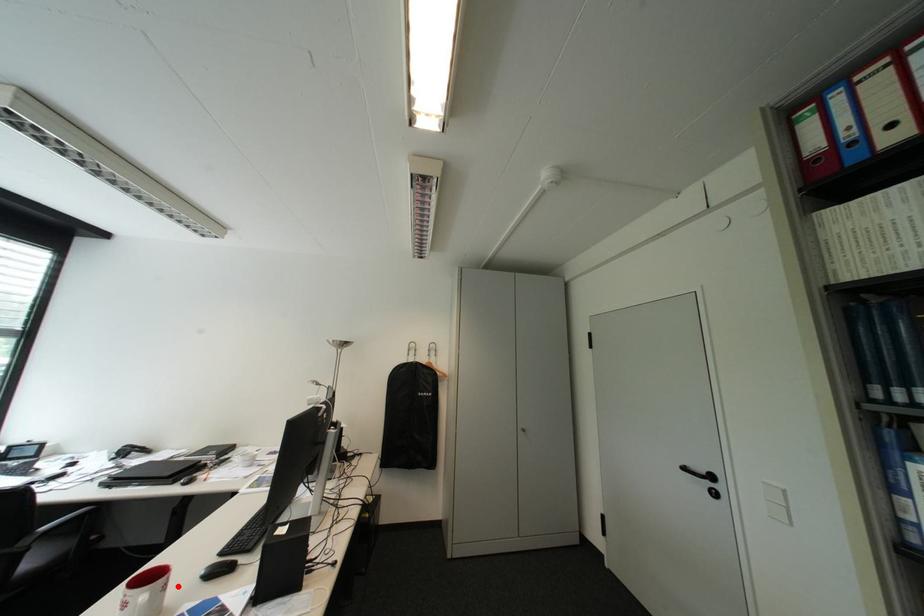
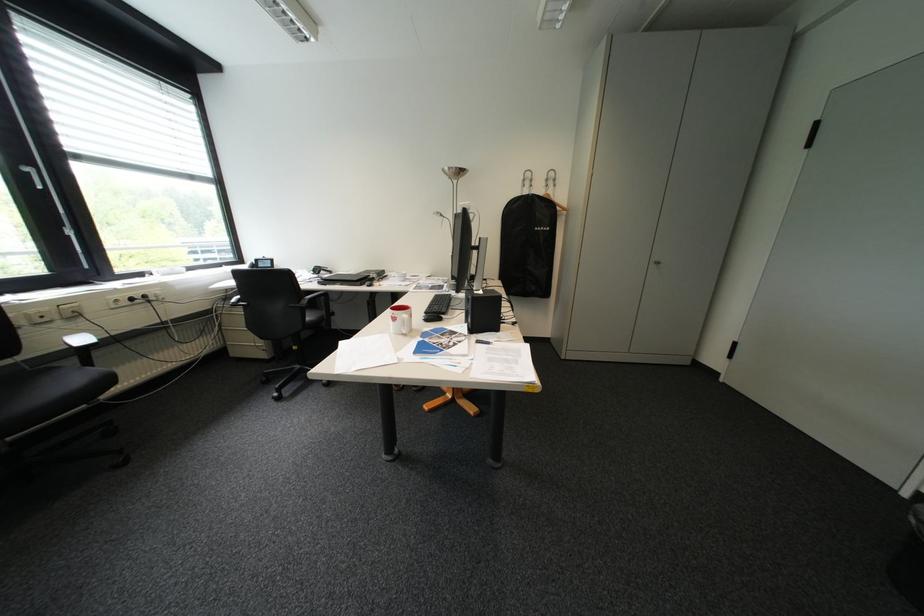
Locate, in the second image, the point that corresponds to the highlighted location in the first image.

(423, 315)